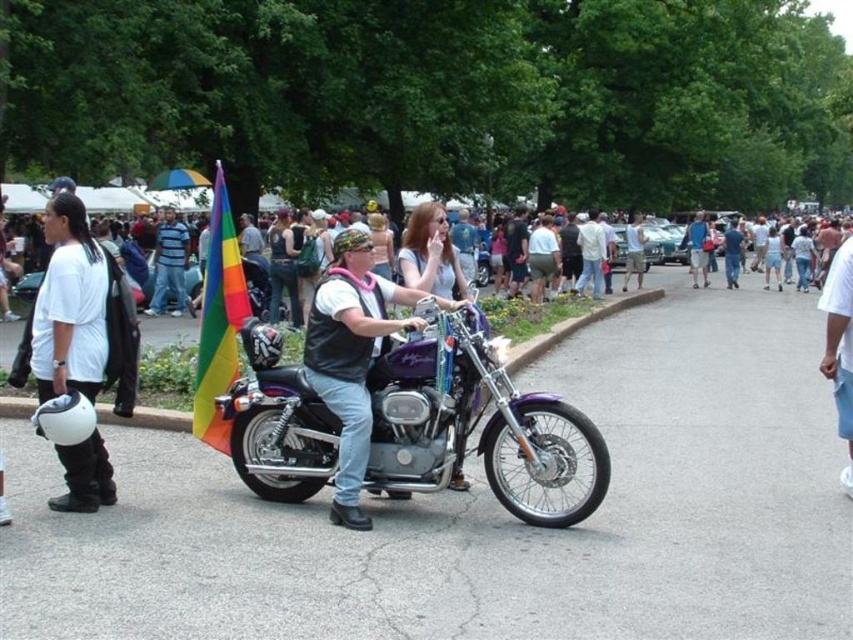
Question: Estimate the real-world distances between objects in this image. Which object is farther from the rainbow flag at upper center?

Choices:
 (A) striped cotton shirt at center
 (B) matte black motorcycle at center

Answer: (B)

Question: From the image, what is the correct spatial relationship of purple metallic motorcycle at center in relation to matte black motorcycle at center?

Choices:
 (A) right
 (B) left

Answer: (A)

Question: Does matte black motorcycle at center appear on the left side of rainbow fabric flag at left?

Choices:
 (A) yes
 (B) no

Answer: (B)

Question: Which point is closer to the camera?

Choices:
 (A) (154, 289)
 (B) (399, 360)
 (C) (218, 332)
 (D) (390, 321)

Answer: (D)

Question: Is purple metallic motorcycle at center bigger than rainbow fabric flag at left?

Choices:
 (A) yes
 (B) no

Answer: (A)

Question: Which object is the farthest from the striped cotton shirt at center?

Choices:
 (A) purple metallic motorcycle at center
 (B) matte black motorcycle at center
 (C) rainbow flag at upper center
 (D) rainbow fabric flag at left

Answer: (A)